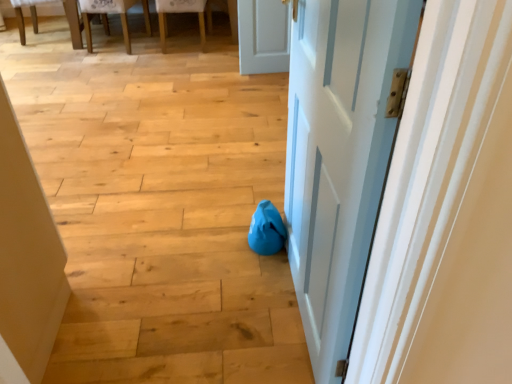
Question: Is white painted wood door at center touching blue fabric bean bag at center?

Choices:
 (A) yes
 (B) no

Answer: (B)

Question: Is white painted wood door at center smaller than blue fabric bean bag at center?

Choices:
 (A) no
 (B) yes

Answer: (A)

Question: Is white painted wood door at center positioned behind blue fabric bean bag at center?

Choices:
 (A) yes
 (B) no

Answer: (B)

Question: Considering the relative positions of white painted wood door at center and blue fabric bean bag at center in the image provided, is white painted wood door at center to the right of blue fabric bean bag at center from the viewer's perspective?

Choices:
 (A) yes
 (B) no

Answer: (A)

Question: Is white painted wood door at center far away from blue fabric bean bag at center?

Choices:
 (A) yes
 (B) no

Answer: (B)

Question: Is blue fabric bean bag at center to the left or to the right of wooden textured chair at upper left, the 2th chair viewed from the right, in the image?

Choices:
 (A) right
 (B) left

Answer: (A)

Question: In terms of width, does blue fabric bean bag at center look wider or thinner when compared to wooden textured chair at upper left, which is the first chair from left to right?

Choices:
 (A) wide
 (B) thin

Answer: (B)

Question: From the image's perspective, is blue fabric bean bag at center above or below wooden textured chair at upper left, the 2th chair viewed from the right?

Choices:
 (A) above
 (B) below

Answer: (B)

Question: Is point (266, 228) closer or farther from the camera than point (141, 1)?

Choices:
 (A) closer
 (B) farther

Answer: (A)

Question: Is wooden textured chair at upper left, which is the first chair from left to right, spatially inside wooden chair at upper left, which ranks as the 2th chair in left-to-right order, or outside of it?

Choices:
 (A) inside
 (B) outside

Answer: (B)

Question: Visually, is wooden textured chair at upper left, which is the first chair from left to right, positioned to the left or to the right of wooden chair at upper left, the 1th chair from the right?

Choices:
 (A) left
 (B) right

Answer: (A)

Question: From the image's perspective, is wooden textured chair at upper left, the 2th chair viewed from the right, located above or below wooden chair at upper left, which ranks as the 2th chair in left-to-right order?

Choices:
 (A) below
 (B) above

Answer: (B)

Question: From a real-world perspective, is wooden textured chair at upper left, the 2th chair viewed from the right, above or below wooden chair at upper left, the 1th chair from the right?

Choices:
 (A) above
 (B) below

Answer: (A)

Question: Considering their positions, is wooden chair at upper left, which ranks as the 2th chair in left-to-right order, located in front of or behind wooden textured chair at upper left, the 2th chair viewed from the right?

Choices:
 (A) behind
 (B) front

Answer: (A)

Question: In the image, is wooden chair at upper left, which ranks as the 2th chair in left-to-right order, on the left side or the right side of wooden textured chair at upper left, the 2th chair viewed from the right?

Choices:
 (A) left
 (B) right

Answer: (B)